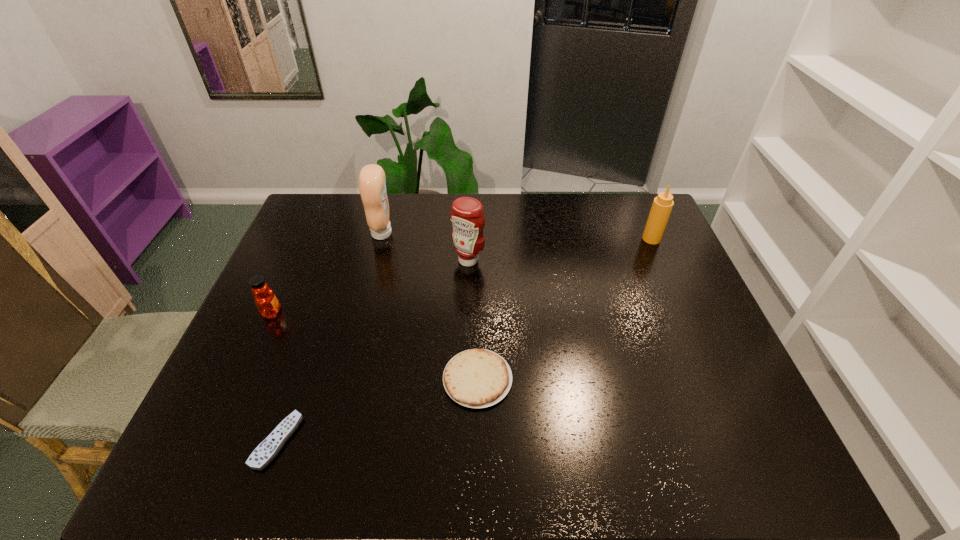
This screenshot has height=540, width=960. What are the coordinates of `free space located 0.230m on the label of the leftmost condiment` in the screenshot? It's located at (462, 233).

Find the location of a particular element. Image resolution: width=960 pixels, height=540 pixels. vacant space situated on the left of the second condiment from right to left is located at coordinates (398, 260).

Locate an element on the screen. The height and width of the screenshot is (540, 960). free point located on the front of the rightmost object is located at coordinates (680, 303).

Where is `free region located on the front label of the fourth farthest object`? This screenshot has width=960, height=540. free region located on the front label of the fourth farthest object is located at coordinates (303, 313).

In order to click on vacant space located 0.070m on the front of the second shortest object in this screenshot , I will do `click(477, 440)`.

Locate an element on the screen. free space located 0.120m on the right of the fifth object from right to left is located at coordinates (352, 440).

I want to click on object that is at the near edge, so click(266, 451).

At what (x,y) coordinates should I click in order to perform the action: click on honey positioned at the left edge. Please return your answer as a coordinate pair (x, y). Looking at the image, I should click on (266, 302).

At what (x,y) coordinates should I click in order to perform the action: click on remote control present at the left edge. Please return your answer as a coordinate pair (x, y). Image resolution: width=960 pixels, height=540 pixels. Looking at the image, I should click on (266, 451).

Where is `object that is at the right edge`? The height and width of the screenshot is (540, 960). object that is at the right edge is located at coordinates (662, 205).